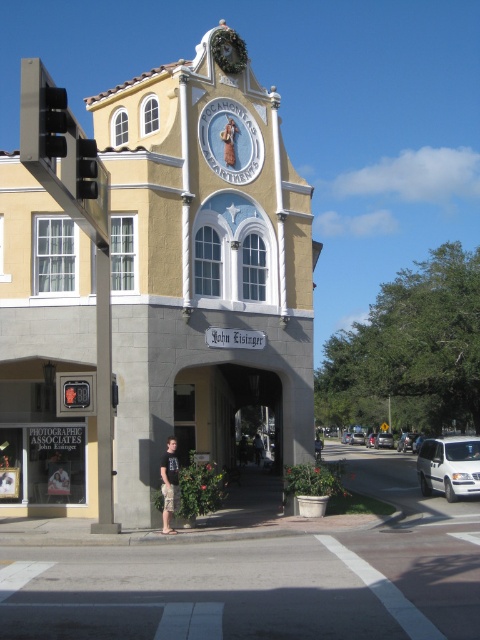
Question: Which object is farther from the camera taking this photo?

Choices:
 (A) black cotton shirt at center
 (B) black plastic traffic light at upper left
 (C) matte white clock at center

Answer: (C)

Question: Which object is the farthest from the brown leather jacket at center?

Choices:
 (A) matte black traffic light at left
 (B) silver metallic sedan at center
 (C) black cotton shirt at center

Answer: (B)

Question: Can you confirm if matte white clock at center is bigger than silver metallic sedan at center?

Choices:
 (A) no
 (B) yes

Answer: (B)

Question: Which object is positioned farthest from the brown leather jacket at center?

Choices:
 (A) black plastic traffic light at upper left
 (B) matte white clock at center

Answer: (A)

Question: Is white glossy sedan at center wider than brown textured shorts at lower center?

Choices:
 (A) no
 (B) yes

Answer: (A)

Question: In this image, where is matte white clock at center located relative to black cotton shirt at center?

Choices:
 (A) below
 (B) above

Answer: (B)